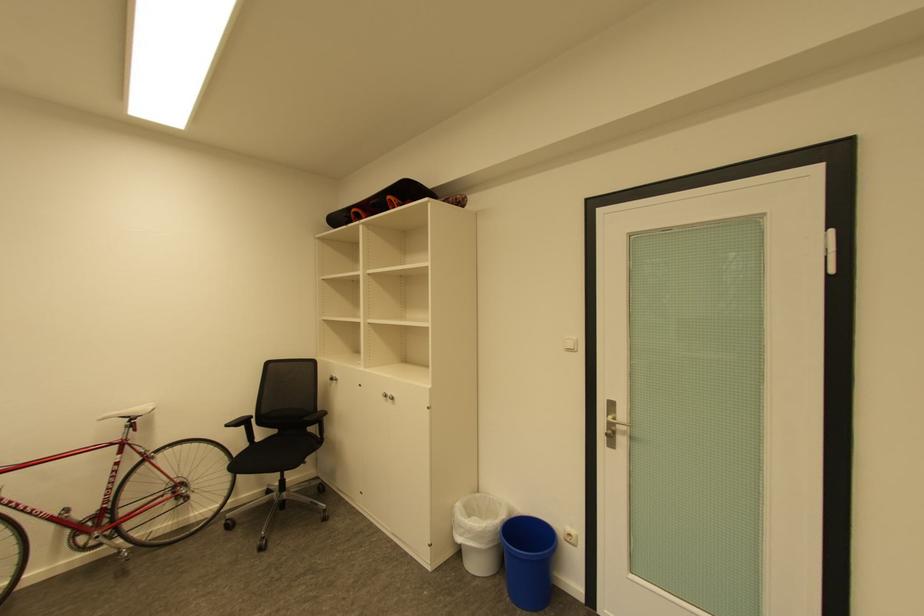
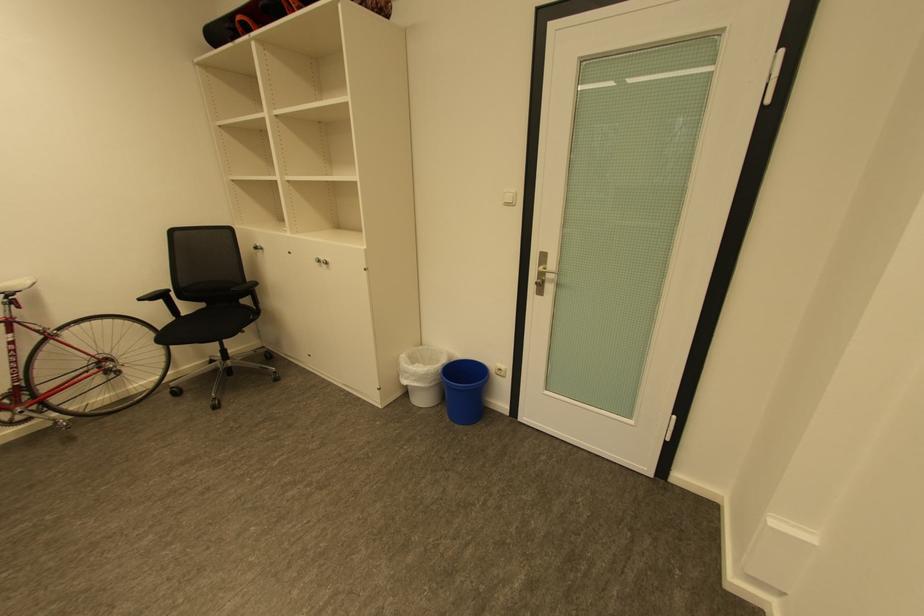
In the second image, find the point that corresponds to point 393,397 in the first image.

(325, 262)